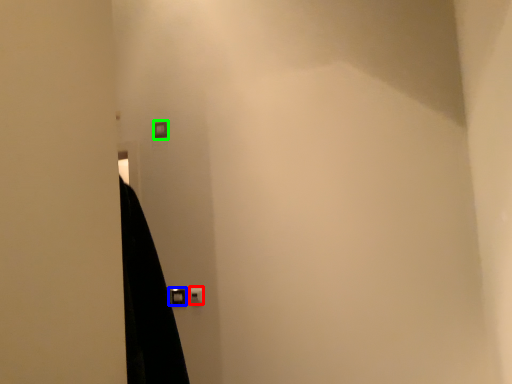
Question: Based on their relative distances, which object is nearer to light switch (highlighted by a red box)? Choose from door handle (highlighted by a blue box) and light switch (highlighted by a green box).

Choices:
 (A) door handle
 (B) light switch

Answer: (A)